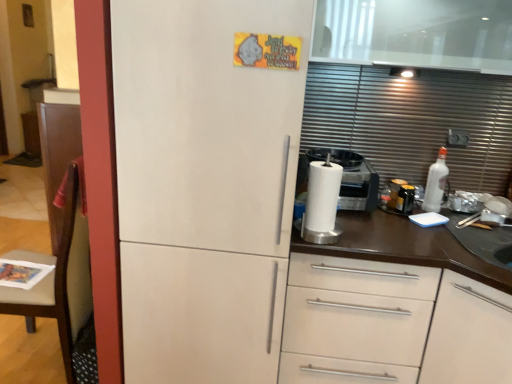
Identify the location of white matte cabinet at center. click(392, 324).

Locate an element on the screen. This screenshot has height=384, width=512. brown wood chair at left is located at coordinates (61, 278).

The height and width of the screenshot is (384, 512). Find the location of `white matte cabinet at center`. white matte cabinet at center is located at coordinates (392, 324).

From the image's perspective, is white matte cabinet at center located above or below brown wood chair at left?

white matte cabinet at center is below brown wood chair at left.

Does white matte cabinet at center appear on the left side of brown wood chair at left?

No.

Is white matte cabinet at center not near brown wood chair at left?

Yes, white matte cabinet at center and brown wood chair at left are quite far apart.

Which object is further away from the camera, white matte refrigerator at center or brown wood chair at left?

brown wood chair at left is further away from the camera.

Would you say white matte refrigerator at center is a long distance from brown wood chair at left?

white matte refrigerator at center is near brown wood chair at left, not far away.

From the image's perspective, is white matte refrigerator at center above or below brown wood chair at left?

white matte refrigerator at center is above brown wood chair at left.

Find the location of a particular element. This screenshot has height=384, width=512. chair that is below the white matte refrigerator at center (from the image's perspective) is located at coordinates (x=61, y=278).

Locate an element on the screen. The width and height of the screenshot is (512, 384). refrigerator above the brown wood chair at left (from the image's perspective) is located at coordinates (204, 187).

Is white matte refrigerator at center surrounded by brown wood chair at left?

No.

Which is more to the left, brown wood chair at left or white matte refrigerator at center?

From the viewer's perspective, brown wood chair at left appears more on the left side.

From a real-world perspective, is brown wood chair at left physically below white matte refrigerator at center?

Indeed, from a real-world perspective, brown wood chair at left is positioned beneath white matte refrigerator at center.

Could you tell me if brown wood chair at left is facing white matte cabinet at center?

No.

Would you say brown wood chair at left is a long distance from white matte cabinet at center?

brown wood chair at left is positioned a significant distance from white matte cabinet at center.

Between brown wood chair at left and white matte cabinet at center, which one is positioned in front?

white matte cabinet at center.

Considering the relative positions of white matte refrigerator at center and white matte cabinet at center in the image provided, is white matte refrigerator at center to the right of white matte cabinet at center from the viewer's perspective?

No.

Measure the distance between white matte refrigerator at center and white matte cabinet at center.

white matte refrigerator at center and white matte cabinet at center are 45.17 centimeters apart from each other.

Does white matte refrigerator at center have a larger size compared to white matte cabinet at center?

Yes, white matte refrigerator at center is bigger than white matte cabinet at center.

Is white matte cabinet at center oriented towards white matte refrigerator at center?

No.

Is point (496, 315) farther from camera compared to point (246, 4)?

That is True.

From the picture: How many degrees apart are the facing directions of white matte cabinet at center and white matte refrigerator at center?

2.29e-05 degrees.

The height and width of the screenshot is (384, 512). In order to click on chair above the white matte cabinet at center (from a real-world perspective) in this screenshot , I will do `click(61, 278)`.

Locate an element on the screen. This screenshot has height=384, width=512. chair beneath the white matte refrigerator at center (from a real-world perspective) is located at coordinates coord(61,278).

Based on their spatial positions, is white matte refrigerator at center or white matte cabinet at center further from brown wood chair at left?

white matte cabinet at center lies further to brown wood chair at left than the other object.

Based on their spatial positions, is white matte cabinet at center or white matte refrigerator at center closer to brown wood chair at left?

Among the two, white matte refrigerator at center is located nearer to brown wood chair at left.

Considering their positions, is brown wood chair at left positioned further to white matte refrigerator at center than white matte cabinet at center?

brown wood chair at left lies further to white matte refrigerator at center than the other object.

Which object lies nearer to the anchor point white matte cabinet at center, white matte refrigerator at center or brown wood chair at left?

white matte refrigerator at center is positioned closer to the anchor white matte cabinet at center.

From the image, which object appears to be nearer to white matte refrigerator at center, white matte cabinet at center or brown wood chair at left?

Based on the image, white matte cabinet at center appears to be nearer to white matte refrigerator at center.

Looking at the image, which one is located closer to white matte cabinet at center, brown wood chair at left or white matte refrigerator at center?

white matte refrigerator at center.

At what (x,y) coordinates should I click in order to perform the action: click on refrigerator situated between brown wood chair at left and white matte cabinet at center from left to right. Please return your answer as a coordinate pair (x, y). This screenshot has width=512, height=384. Looking at the image, I should click on (204, 187).